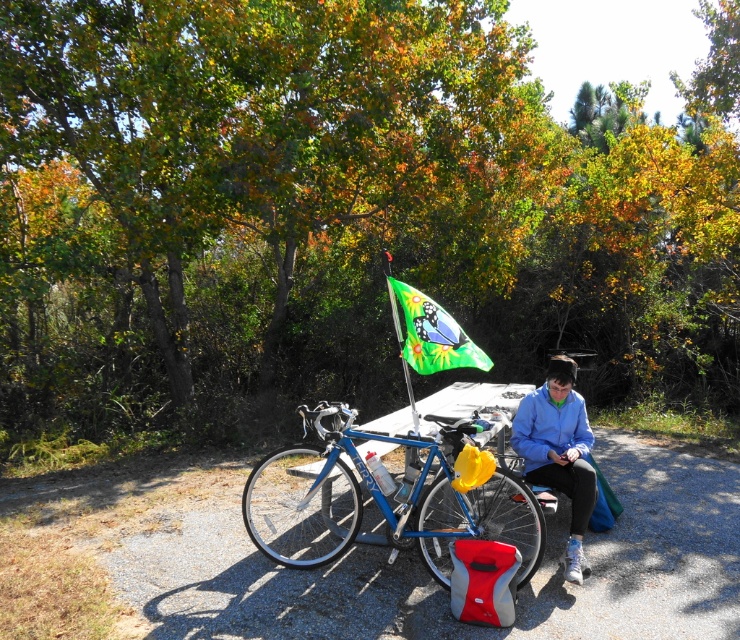
You are standing at the edge of the gravel path and see both the blue fabric jacket at center and the green fabric flag at center. Which object is nearer to you?

The blue fabric jacket at center is closer to the viewer than the green fabric jacket at center.

You are a hiker who wants to take a photo of both the blue metallic bicycle at center and the blue fabric jacket at center. Where should you stand to capture both items in the frame?

You should stand to the right of the blue metallic bicycle at center and blue fabric jacket at center to capture both items in the frame since the blue metallic bicycle at center is on the left side of the blue fabric jacket at center.